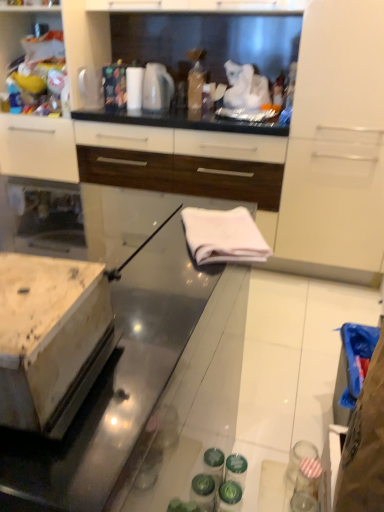
Question: Considering the relative sizes of white fabric at center and white glossy towel at center in the image provided, is white fabric at center wider than white glossy towel at center?

Choices:
 (A) yes
 (B) no

Answer: (B)

Question: From a real-world perspective, is white fabric at center on top of white glossy towel at center?

Choices:
 (A) no
 (B) yes

Answer: (B)

Question: Is white fabric at center thinner than white glossy towel at center?

Choices:
 (A) no
 (B) yes

Answer: (B)

Question: From a real-world perspective, is white fabric at center located beneath white glossy towel at center?

Choices:
 (A) yes
 (B) no

Answer: (B)

Question: Is the depth of white fabric at center greater than that of white glossy towel at center?

Choices:
 (A) yes
 (B) no

Answer: (A)

Question: Can you confirm if white fabric at center is positioned to the right of white glossy towel at center?

Choices:
 (A) no
 (B) yes

Answer: (B)

Question: Is white glossy cabinet at upper left, arranged as the 1th cabinetry when viewed from the left, outside white glossy electric kettle at upper center?

Choices:
 (A) yes
 (B) no

Answer: (A)

Question: Considering the relative sizes of white glossy cabinet at upper left, the second cabinetry viewed from the right, and white glossy electric kettle at upper center in the image provided, is white glossy cabinet at upper left, the second cabinetry viewed from the right, thinner than white glossy electric kettle at upper center?

Choices:
 (A) yes
 (B) no

Answer: (B)

Question: From the image's perspective, is white glossy cabinet at upper left, arranged as the 1th cabinetry when viewed from the left, located beneath white glossy electric kettle at upper center?

Choices:
 (A) yes
 (B) no

Answer: (A)

Question: Is white glossy cabinet at upper left, arranged as the 1th cabinetry when viewed from the left, smaller than white glossy electric kettle at upper center?

Choices:
 (A) no
 (B) yes

Answer: (A)

Question: Is white glossy cabinet at upper left, the second cabinetry viewed from the right, bigger than white glossy electric kettle at upper center?

Choices:
 (A) yes
 (B) no

Answer: (A)

Question: Is white glossy cabinet at upper left, the second cabinetry viewed from the right, wider than white glossy electric kettle at upper center?

Choices:
 (A) yes
 (B) no

Answer: (A)

Question: Considering the relative sizes of white glossy cabinet at upper left, the second cabinetry viewed from the right, and white glossy cabinet at upper center, the 1th cabinetry from the right, in the image provided, is white glossy cabinet at upper left, the second cabinetry viewed from the right, thinner than white glossy cabinet at upper center, the 1th cabinetry from the right,?

Choices:
 (A) yes
 (B) no

Answer: (B)